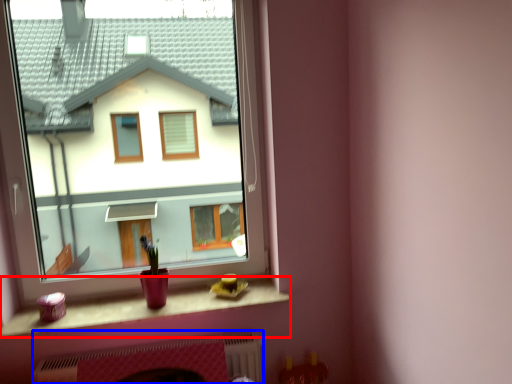
Question: Which point is closer to the camera, window sill (highlighted by a red box) or fireplace (highlighted by a blue box)?

Choices:
 (A) window sill
 (B) fireplace

Answer: (A)